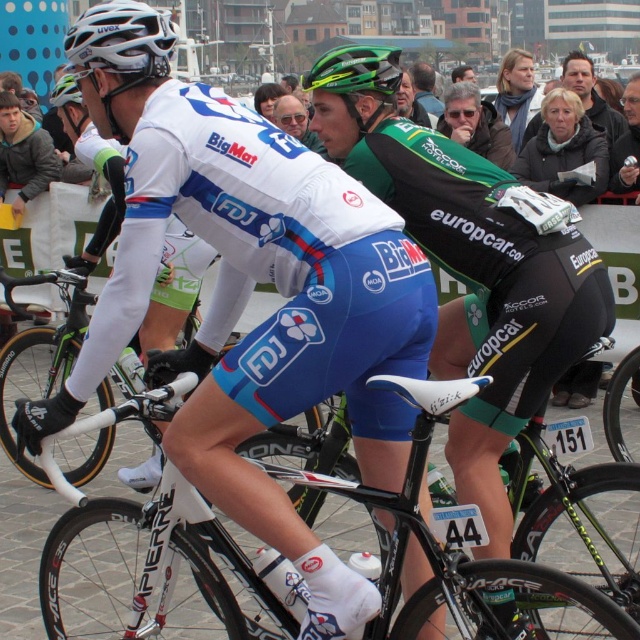
Describe the element at coordinates (122, 38) in the screenshot. I see `white matte bicycle helmet at upper left` at that location.

Between white matte bicycle helmet at upper left and black jersey at center, which one has less height?

black jersey at center

Does point (118, 26) lie in front of point (460, 120)?

That is True.

Where is `white matte bicycle helmet at upper left`? The image size is (640, 640). white matte bicycle helmet at upper left is located at coordinates tap(122, 38).

Is point (108, 54) positioned after point (364, 52)?

No, (108, 54) is closer to viewer.

Between white matte bicycle helmet at upper left and green matte bicycle helmet at center, which one has more height?

Standing taller between the two is white matte bicycle helmet at upper left.

Who is more distant from viewer, (115,17) or (397,84)?

The point (397,84) is more distant.

This screenshot has width=640, height=640. I want to click on white matte bicycle helmet at upper left, so click(122, 38).

Is point (344, 77) positioned behind point (83, 113)?

No, it is in front of (83, 113).

Can you confirm if black/green jersey at center is positioned to the left of green matte helmet at upper center?

In fact, black/green jersey at center is to the right of green matte helmet at upper center.

Does point (365, 120) come behind point (67, 109)?

No, it is not.

This screenshot has width=640, height=640. Identify the location of black/green jersey at center. (470, 266).